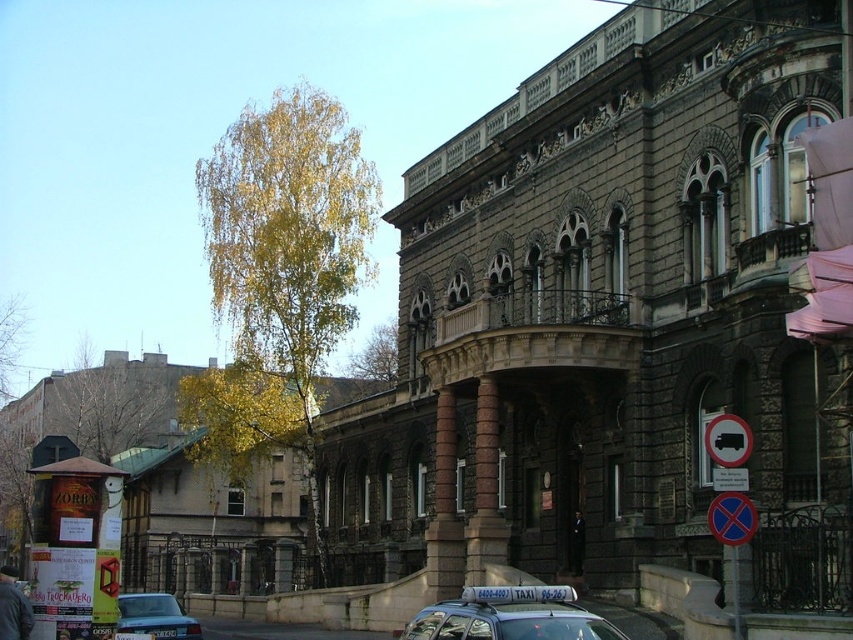
You are standing at the entrance of the historic building and want to take a photo of two specific points marked in the image. The first point is at coordinate point(82, 422) and the second is at point(537, 628). Which point should you focus on first if you want to capture them in the order they appear from your current position?

Point(537, 628) should be focused on first because it is closer to you than point(82, 422), which is behind it.

You are standing at the entrance of the grand historic building and want to hail the metallic silver taxi at center. Based on the coordinates provided, in which direction should you walk to reach the taxi?

The metallic silver taxi at center is located at coordinates point (509, 616), which means it is positioned to the right and slightly forward from the entrance. You should walk towards the right side of the building and slightly forward to reach the taxi.